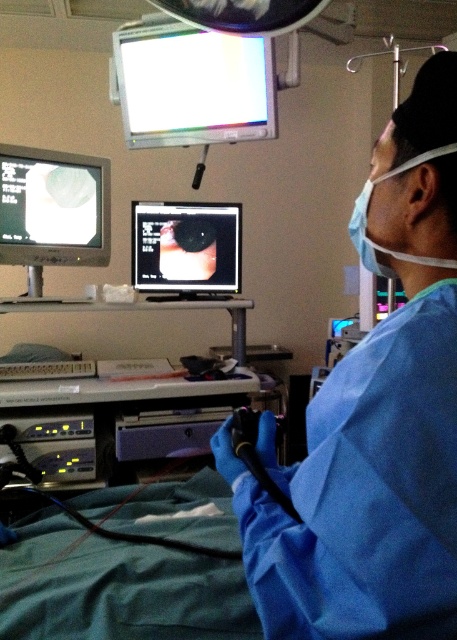
You are a medical student observing the procedure. You need to adjust the settings on both the white glossy monitor at upper center and the matte black monitor at upper left. Which monitor should you approach first to make adjustments?

You should approach the white glossy monitor at upper center first because it is closer to you than the matte black monitor at upper left, so you can adjust it without needing to move further away.

You are a medical technician in the room and need to adjust the settings on both the white glossy monitor at upper center and the matte black monitor at upper left. Which monitor requires you to move further to your right to reach it?

The white glossy monitor at upper center requires moving further to the right because it is positioned wider than the matte black monitor at upper left.

You are a medical student observing the scene. The blue surgical gown at center and the matte black monitor at center are both in your line of sight. Which object is closer to you?

The blue surgical gown at center is closer to you because it is positioned under the matte black monitor at center, indicating it is lower in the visual hierarchy and thus nearer in the spatial arrangement.